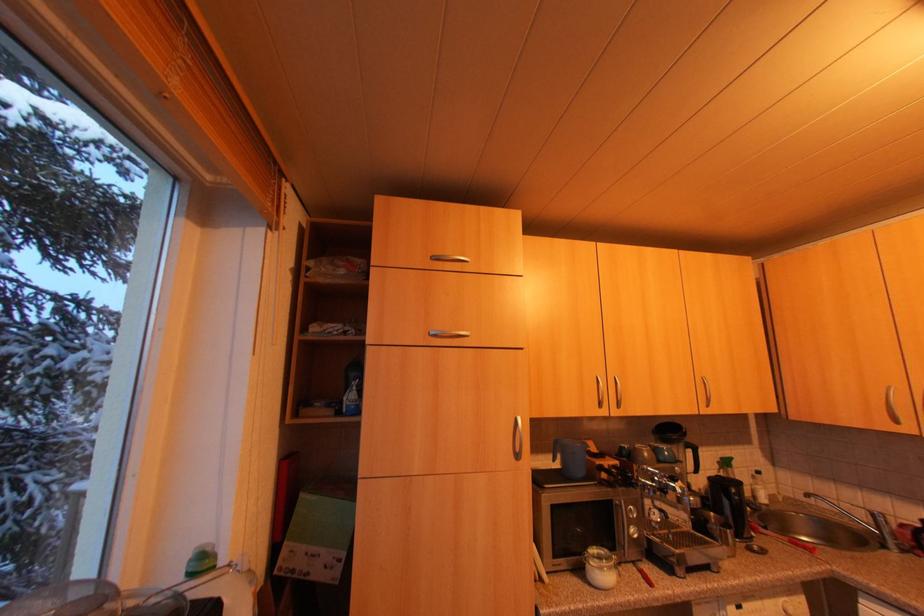
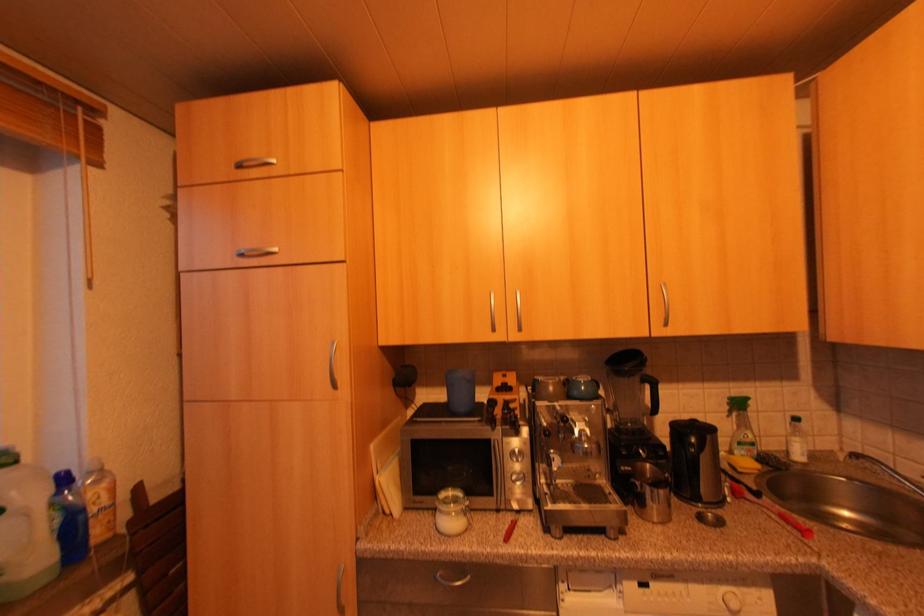
Which direction would the cameraman need to move to produce the second image?

The cameraman moved toward right, forward.